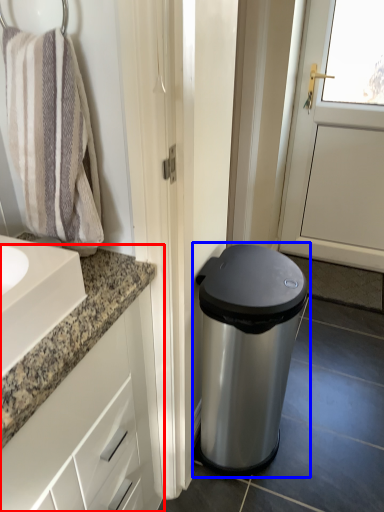
Question: Among these objects, which one is nearest to the camera, bathroom cabinet (highlighted by a red box) or waste container (highlighted by a blue box)?

Choices:
 (A) bathroom cabinet
 (B) waste container

Answer: (A)